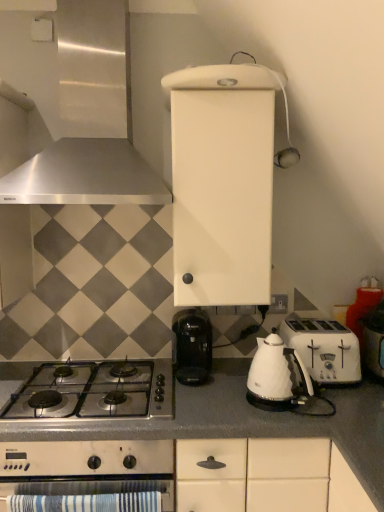
The image size is (384, 512). I want to click on space that is in front of white plastic toaster at right, so click(361, 399).